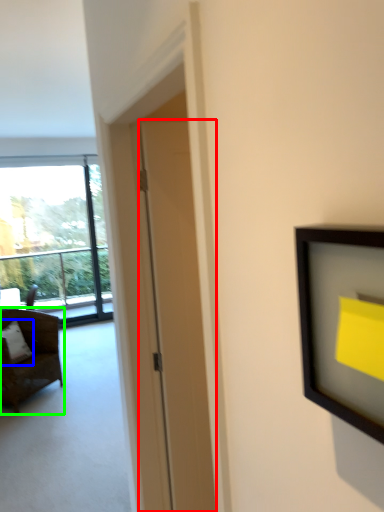
Question: Which object is positioned closest to door (highlighted by a red box)? Select from pillow (highlighted by a blue box) and chair (highlighted by a green box).

Choices:
 (A) pillow
 (B) chair

Answer: (B)